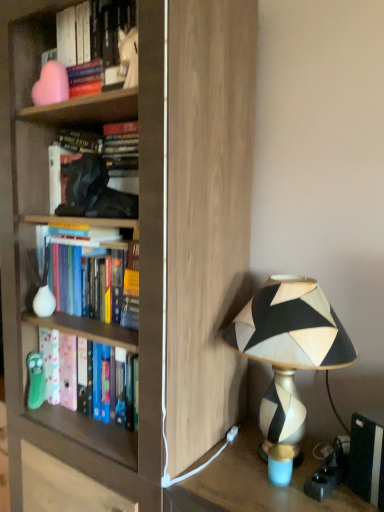
Question: Relative to black matte book at lower right, is matte wood bookcase at center in front or behind?

Choices:
 (A) behind
 (B) front

Answer: (B)

Question: In terms of height, does matte wood bookcase at center look taller or shorter compared to black matte book at lower right?

Choices:
 (A) tall
 (B) short

Answer: (A)

Question: Estimate the real-world distances between objects in this image. Which object is closer to the hardcover books at left, the 4th book positioned from the top?

Choices:
 (A) geometric-patterned lampshade at right
 (B) hardcover books at center left, which is the second book from bottom to top
 (C) matte wood bookcase at center
 (D) hardcover book at center, the 3th book in the bottom-to-top sequence
 (E) pink matte vase at upper left, marked as the first book in a top-to-bottom arrangement

Answer: (B)

Question: Based on their relative distances, which object is nearer to the pink matte vase at upper left, marked as the first book in a top-to-bottom arrangement?

Choices:
 (A) black matte book at lower right
 (B) hardcover books at center left, which is the second book from bottom to top
 (C) hardcover book at center, the 3th book in the bottom-to-top sequence
 (D) matte wood bookcase at center
 (E) hardcover books at left, the 4th book positioned from the top

Answer: (C)